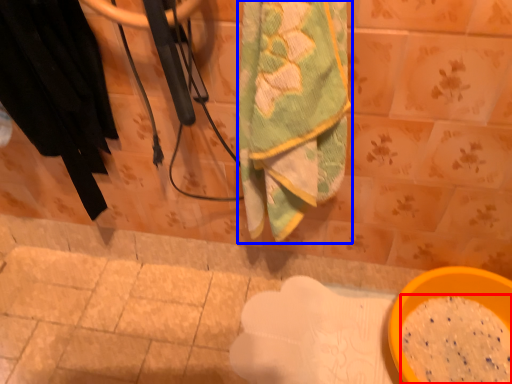
Question: Which object appears farthest to the camera in this image, powder (highlighted by a red box) or towel (highlighted by a blue box)?

Choices:
 (A) powder
 (B) towel

Answer: (A)